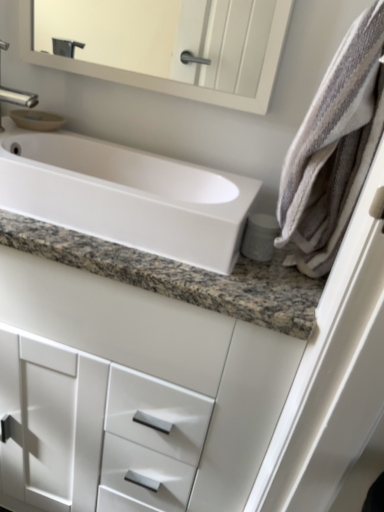
Question: Is the position of silver metallic faucet at upper left less distant than that of striped cotton bath towel at right?

Choices:
 (A) yes
 (B) no

Answer: (B)

Question: Considering the relative sizes of silver metallic faucet at upper left and striped cotton bath towel at right in the image provided, is silver metallic faucet at upper left smaller than striped cotton bath towel at right?

Choices:
 (A) yes
 (B) no

Answer: (A)

Question: Does silver metallic faucet at upper left contain striped cotton bath towel at right?

Choices:
 (A) no
 (B) yes

Answer: (A)

Question: Is silver metallic faucet at upper left oriented away from striped cotton bath towel at right?

Choices:
 (A) no
 (B) yes

Answer: (A)

Question: From the image's perspective, would you say silver metallic faucet at upper left is positioned over striped cotton bath towel at right?

Choices:
 (A) yes
 (B) no

Answer: (A)

Question: Can you confirm if silver metallic faucet at upper left is positioned to the left of striped cotton bath towel at right?

Choices:
 (A) no
 (B) yes

Answer: (B)

Question: Does white glossy cabinet at center touch silver metallic faucet at upper left?

Choices:
 (A) yes
 (B) no

Answer: (B)

Question: Is white glossy cabinet at center wider than silver metallic faucet at upper left?

Choices:
 (A) no
 (B) yes

Answer: (B)

Question: Is silver metallic faucet at upper left inside white glossy cabinet at center?

Choices:
 (A) yes
 (B) no

Answer: (B)

Question: Is white glossy cabinet at center at the right side of silver metallic faucet at upper left?

Choices:
 (A) no
 (B) yes

Answer: (B)

Question: Can you confirm if white glossy cabinet at center is positioned to the left of silver metallic faucet at upper left?

Choices:
 (A) no
 (B) yes

Answer: (A)

Question: From the image's perspective, is white glossy cabinet at center under silver metallic faucet at upper left?

Choices:
 (A) no
 (B) yes

Answer: (B)

Question: Is white glossy cabinet at center turned away from white glossy sink at center?

Choices:
 (A) no
 (B) yes

Answer: (A)